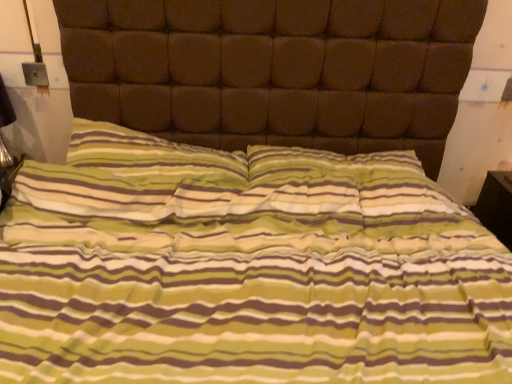
Describe the element at coordinates (35, 74) in the screenshot. I see `metallic silver outlet at upper left` at that location.

Find the location of a particular element. This screenshot has height=384, width=512. metallic silver outlet at upper left is located at coordinates (35, 74).

The height and width of the screenshot is (384, 512). Find the location of `metallic silver outlet at upper left`. metallic silver outlet at upper left is located at coordinates (35, 74).